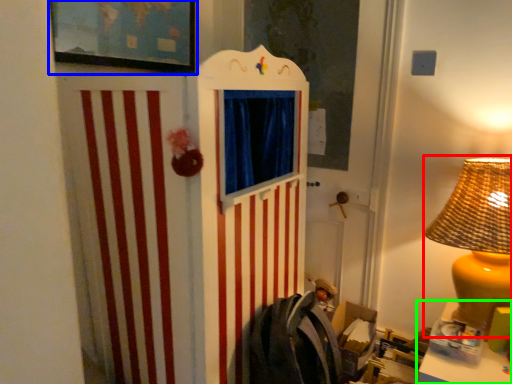
Question: Which is nearer to the table lamp (highlighted by a red box)? picture frame (highlighted by a blue box) or table (highlighted by a green box).

Choices:
 (A) picture frame
 (B) table

Answer: (B)